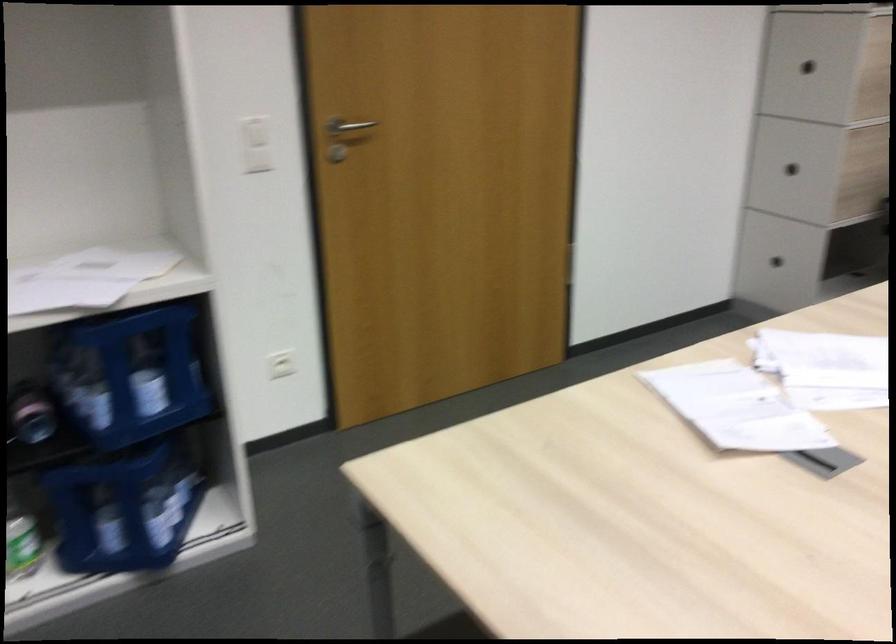
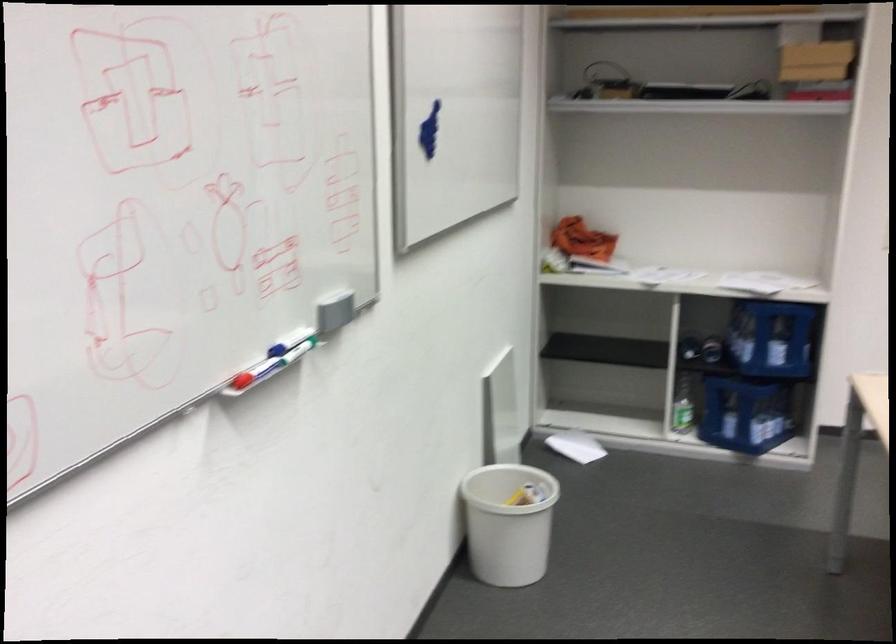
The point at (142, 375) is marked in the first image. Where is the corresponding point in the second image?

(771, 337)